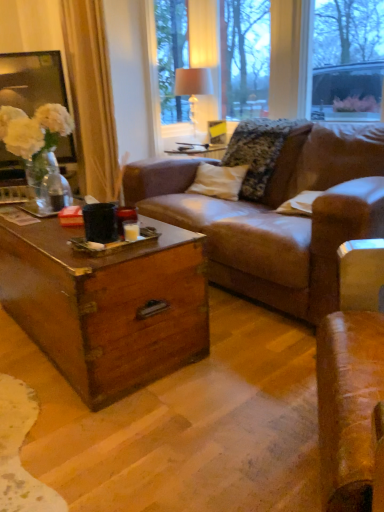
Question: From the image's perspective, is white fabric lampshade at upper center under beige fabric curtain at left?

Choices:
 (A) yes
 (B) no

Answer: (B)

Question: Can you confirm if white fabric lampshade at upper center is thinner than beige fabric curtain at left?

Choices:
 (A) yes
 (B) no

Answer: (A)

Question: Is white fabric lampshade at upper center located outside beige fabric curtain at left?

Choices:
 (A) yes
 (B) no

Answer: (A)

Question: Is white fabric lampshade at upper center looking in the opposite direction of beige fabric curtain at left?

Choices:
 (A) yes
 (B) no

Answer: (B)

Question: Considering the relative sizes of white fabric lampshade at upper center and beige fabric curtain at left in the image provided, is white fabric lampshade at upper center smaller than beige fabric curtain at left?

Choices:
 (A) no
 (B) yes

Answer: (B)

Question: Would you say white fabric lampshade at upper center contains beige fabric curtain at left?

Choices:
 (A) yes
 (B) no

Answer: (B)

Question: Considering the relative sizes of fluffy fabric pillow at center and white fabric lampshade at upper center in the image provided, is fluffy fabric pillow at center bigger than white fabric lampshade at upper center?

Choices:
 (A) yes
 (B) no

Answer: (A)

Question: Is fluffy fabric pillow at center facing away from white fabric lampshade at upper center?

Choices:
 (A) no
 (B) yes

Answer: (A)

Question: Is the depth of fluffy fabric pillow at center less than that of white fabric lampshade at upper center?

Choices:
 (A) no
 (B) yes

Answer: (B)

Question: From the image's perspective, is fluffy fabric pillow at center on white fabric lampshade at upper center?

Choices:
 (A) no
 (B) yes

Answer: (A)

Question: Considering the relative sizes of fluffy fabric pillow at center and white fabric lampshade at upper center in the image provided, is fluffy fabric pillow at center taller than white fabric lampshade at upper center?

Choices:
 (A) yes
 (B) no

Answer: (B)

Question: Considering the relative sizes of fluffy fabric pillow at center and white fabric lampshade at upper center in the image provided, is fluffy fabric pillow at center thinner than white fabric lampshade at upper center?

Choices:
 (A) no
 (B) yes

Answer: (A)

Question: From a real-world perspective, is beige fabric curtain at left physically below matte glass vase at upper center?

Choices:
 (A) no
 (B) yes

Answer: (B)